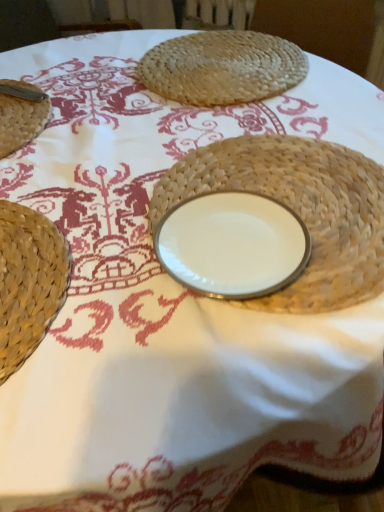
Measure the distance between woven straw placemat at upper center and camera.

They are 32.40 inches apart.

In order to click on white porcelain plate at center in this screenshot , I will do `click(233, 244)`.

You are a GUI agent. You are given a task and a screenshot of the screen. Output one action in this format:
    pyautogui.click(x=<x>, y=<y>)
    Task: Click on the woven straw placemat at upper center
    The height and width of the screenshot is (512, 384).
    Given the screenshot: What is the action you would take?
    pyautogui.click(x=222, y=67)

Is point (376, 248) behind point (138, 76)?

No, it is in front of (138, 76).

Which is correct: woven straw plate at center is inside woven straw placemat at upper center, or outside of it?

woven straw plate at center is located beyond the bounds of woven straw placemat at upper center.

Is woven straw plate at center to the left or to the right of woven straw placemat at upper center in the image?

woven straw plate at center is to the right of woven straw placemat at upper center.

Can you tell me how much woven straw plate at center and woven straw placemat at upper center differ in facing direction?

They differ by 0.000253 degrees in their facing directions.

From the image's perspective, which is below, white porcelain plate at center or woven straw placemat at upper center?

white porcelain plate at center.

Between point (194, 237) and point (184, 61), which one is positioned in front?

The point (194, 237) is in front.

Would you consider white porcelain plate at center to be distant from woven straw placemat at upper center?

No, white porcelain plate at center is not far away from woven straw placemat at upper center.

Considering the positions of points (148, 63) and (246, 284), is point (148, 63) closer to camera compared to point (246, 284)?

No.

Does woven straw placemat at upper center have a lesser width compared to white porcelain plate at center?

In fact, woven straw placemat at upper center might be wider than white porcelain plate at center.

Is woven straw placemat at upper center oriented towards white porcelain plate at center?

Yes, woven straw placemat at upper center is facing white porcelain plate at center.

Is woven straw placemat at upper center wider or thinner than woven straw plate at center?

woven straw placemat at upper center is thinner than woven straw plate at center.

Considering the positions of objects woven straw placemat at upper center and woven straw plate at center in the image provided, who is in front, woven straw placemat at upper center or woven straw plate at center?

woven straw plate at center is in front.

Where is `straw hat on the right side of woven straw placemat at upper center`? This screenshot has width=384, height=512. straw hat on the right side of woven straw placemat at upper center is located at coordinates (298, 210).

From the picture: Is woven straw placemat at upper center not close to woven straw plate at center?

woven straw placemat at upper center is actually quite close to woven straw plate at center.

From the picture: Is white porcelain plate at center in contact with woven straw plate at center?

Yes.

From the image's perspective, is white porcelain plate at center below woven straw plate at center?

Yes, from the image's perspective, white porcelain plate at center is beneath woven straw plate at center.

From a real-world perspective, is white porcelain plate at center above or below woven straw plate at center?

From a real-world perspective, white porcelain plate at center is physically above woven straw plate at center.

Which is correct: white porcelain plate at center is inside woven straw plate at center, or outside of it?

white porcelain plate at center lies within the bounds of woven straw plate at center.

Measure the distance from woven straw plate at center to white porcelain plate at center.

A distance of 2.95 inches exists between woven straw plate at center and white porcelain plate at center.

Are woven straw plate at center and white porcelain plate at center beside each other?

Yes, the surface of woven straw plate at center is in contact with white porcelain plate at center.

In terms of size, does woven straw plate at center appear bigger or smaller than white porcelain plate at center?

Clearly, woven straw plate at center is larger in size than white porcelain plate at center.

From the picture: From a real-world perspective, who is located higher, woven straw plate at center or white porcelain plate at center?

From a 3D spatial view, white porcelain plate at center is above.

Image resolution: width=384 pixels, height=512 pixels. What are the coordinates of `straw hat below the woven straw placemat at upper center (from the image's perspective)` in the screenshot? It's located at (298, 210).

The height and width of the screenshot is (512, 384). Identify the location of tableware in front of the woven straw placemat at upper center. tap(233, 244).

Which object lies nearer to the anchor point woven straw plate at center, white porcelain plate at center or woven straw placemat at upper center?

white porcelain plate at center is positioned closer to the anchor woven straw plate at center.

Looking at the image, which one is located further to white porcelain plate at center, woven straw placemat at upper center or woven straw plate at center?

woven straw placemat at upper center is further to white porcelain plate at center.

Considering their positions, is white porcelain plate at center positioned further to woven straw placemat at upper center than woven straw plate at center?

Based on the image, white porcelain plate at center appears to be further to woven straw placemat at upper center.

When comparing their distances from white porcelain plate at center, does woven straw plate at center or woven straw placemat at upper center seem further?

woven straw placemat at upper center lies further to white porcelain plate at center than the other object.

Looking at the image, which one is located further to woven straw placemat at upper center, woven straw plate at center or white porcelain plate at center?

white porcelain plate at center is positioned further to the anchor woven straw placemat at upper center.

Which object lies further to the anchor point woven straw plate at center, woven straw placemat at upper center or white porcelain plate at center?

woven straw placemat at upper center.

What are the coordinates of `straw hat between woven straw placemat at upper center and white porcelain plate at center in the up-down direction` in the screenshot? It's located at (298, 210).